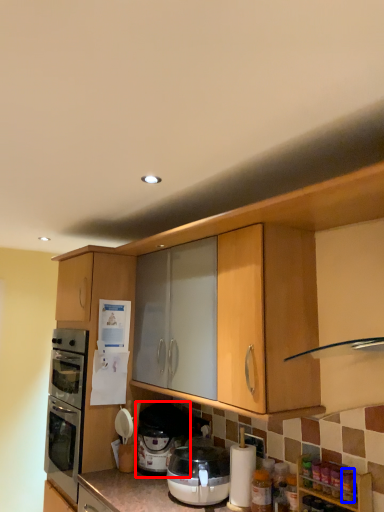
Question: Which object is further to the camera taking this photo, pressure cooker (highlighted by a red box) or bottle (highlighted by a blue box)?

Choices:
 (A) pressure cooker
 (B) bottle

Answer: (A)